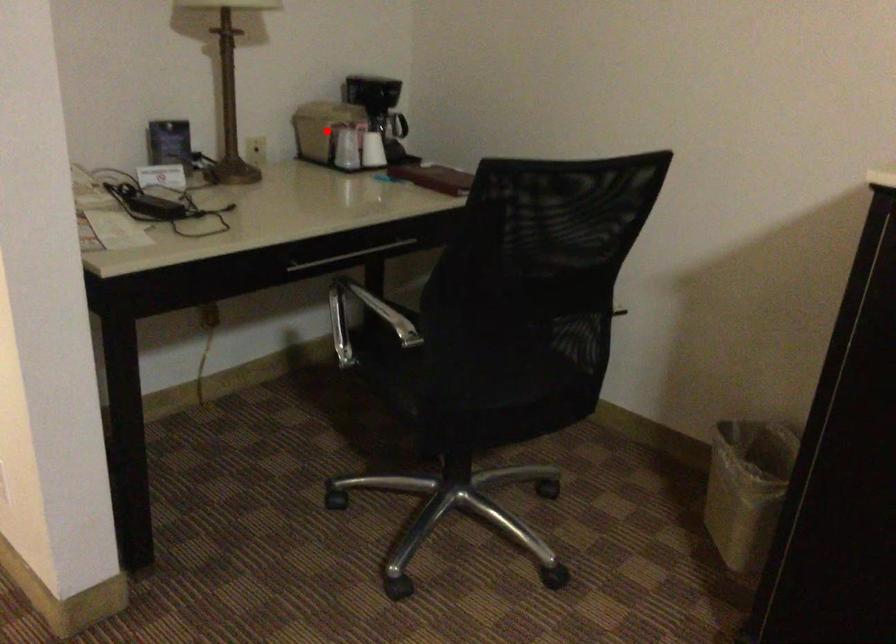
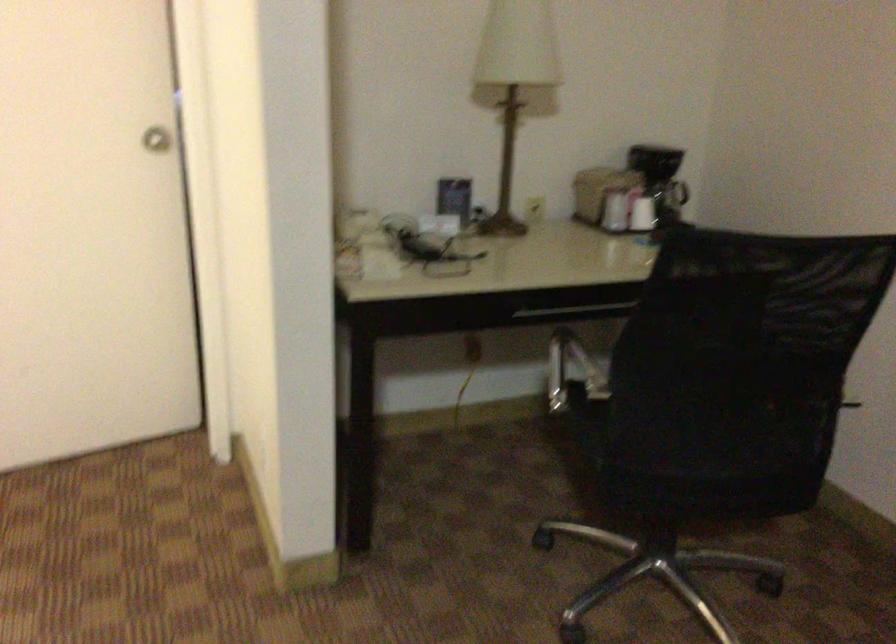
Locate, in the second image, the point that corresponds to the highlighted location in the first image.

(598, 192)